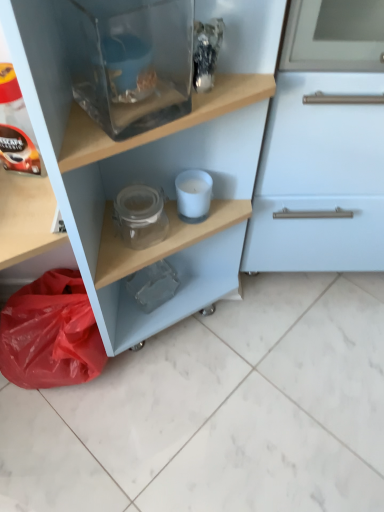
Question: Can you confirm if white matte candle at center, the first appliance positioned from the bottom, is bigger than red plastic bag at lower left?

Choices:
 (A) yes
 (B) no

Answer: (B)

Question: Does white matte candle at center, which appears as the 1th appliance when viewed from the back, contain red plastic bag at lower left?

Choices:
 (A) yes
 (B) no

Answer: (B)

Question: Is white matte candle at center, arranged as the 2th appliance when viewed from the front, at the left side of red plastic bag at lower left?

Choices:
 (A) yes
 (B) no

Answer: (B)

Question: Is red plastic bag at lower left at the back of white matte candle at center, the first appliance positioned from the bottom?

Choices:
 (A) no
 (B) yes

Answer: (A)

Question: From the image's perspective, is white matte candle at center, acting as the second appliance starting from the top, over red plastic bag at lower left?

Choices:
 (A) no
 (B) yes

Answer: (B)

Question: Is matte black coffee pod at left in front of or behind transparent glass fish tank at upper center, arranged as the 1th appliance when viewed from the front, in the image?

Choices:
 (A) behind
 (B) front

Answer: (A)

Question: Is matte black coffee pod at left to the left or to the right of transparent glass fish tank at upper center, which is the 2th appliance in bottom-to-top order, in the image?

Choices:
 (A) left
 (B) right

Answer: (A)

Question: From a real-world perspective, relative to transparent glass fish tank at upper center, the 2th appliance from the back, is matte black coffee pod at left vertically above or below?

Choices:
 (A) below
 (B) above

Answer: (A)

Question: Is point (24, 113) positioned closer to the camera than point (104, 7)?

Choices:
 (A) closer
 (B) farther

Answer: (B)

Question: From a real-world perspective, is transparent glass fish tank at upper center, arranged as the 1th appliance when viewed from the top, above or below matte black coffee pod at left?

Choices:
 (A) below
 (B) above

Answer: (B)

Question: Considering the positions of point coord(119,34) and point coord(13,119), is point coord(119,34) closer or farther from the camera than point coord(13,119)?

Choices:
 (A) farther
 (B) closer

Answer: (B)

Question: Looking at the image, does transparent glass fish tank at upper center, arranged as the 1th appliance when viewed from the top, seem bigger or smaller compared to matte black coffee pod at left?

Choices:
 (A) big
 (B) small

Answer: (A)

Question: Is transparent glass fish tank at upper center, arranged as the 1th appliance when viewed from the top, in front of or behind matte black coffee pod at left in the image?

Choices:
 (A) behind
 (B) front

Answer: (B)

Question: From a real-world perspective, is matte black coffee pod at left physically located above or below red plastic bag at lower left?

Choices:
 (A) above
 (B) below

Answer: (A)

Question: Considering their positions, is matte black coffee pod at left located in front of or behind red plastic bag at lower left?

Choices:
 (A) behind
 (B) front

Answer: (B)